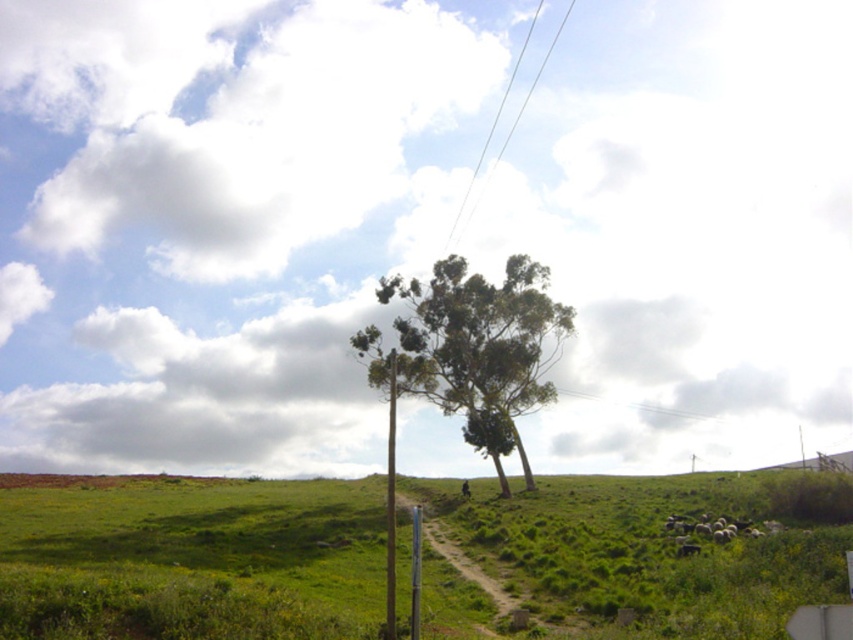
Where is `dirt path at center`? This screenshot has width=853, height=640. dirt path at center is located at coordinates (460, 557).

Who is shorter, dirt path at center or clear wire at upper center?

dirt path at center

Is point (457, 545) more distant than point (529, 36)?

That is False.

Find the location of a particular element. The width and height of the screenshot is (853, 640). dirt path at center is located at coordinates (460, 557).

Is clear wire at upper center in front of metallic pole at center?

No, clear wire at upper center is behind metallic pole at center.

Based on the photo, between clear wire at upper center and metallic pole at center, which one appears on the left side from the viewer's perspective?

From the viewer's perspective, metallic pole at center appears more on the left side.

Is point (494, 125) positioned behind point (393, 508)?

Yes, point (494, 125) is farther from viewer.

Find the location of a particular element. The image size is (853, 640). clear wire at upper center is located at coordinates (488, 141).

Is point (277, 572) farther from camera compared to point (390, 410)?

Yes.

Does green grassy hill at center have a greater width compared to metallic pole at center?

Yes.

Where is `green grassy hill at center`? green grassy hill at center is located at coordinates (190, 557).